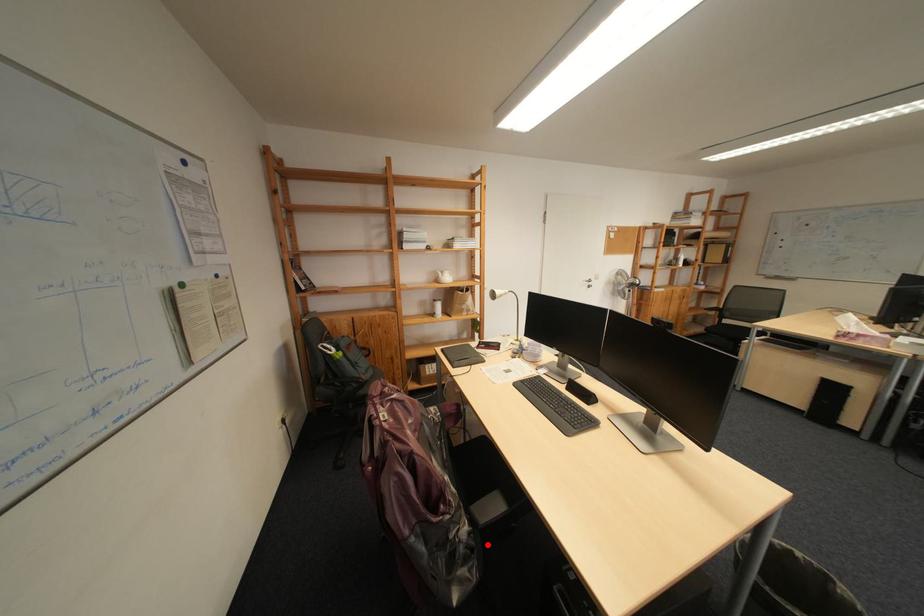
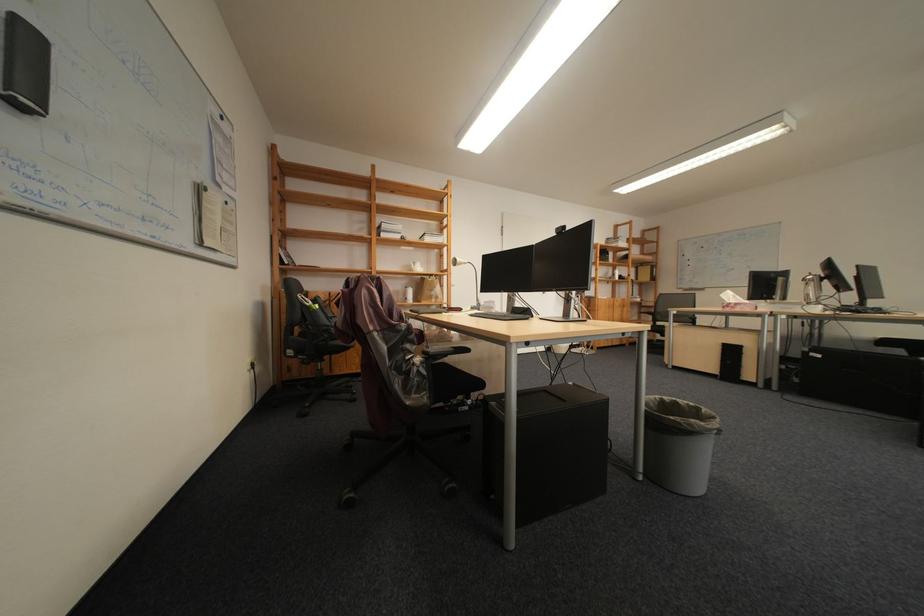
Question: I am providing you with two images of the same scene from different viewpoints. A red point is marked on the first image. Is the red point's position out of view in image 2?

Choices:
 (A) Yes
 (B) No

Answer: (B)